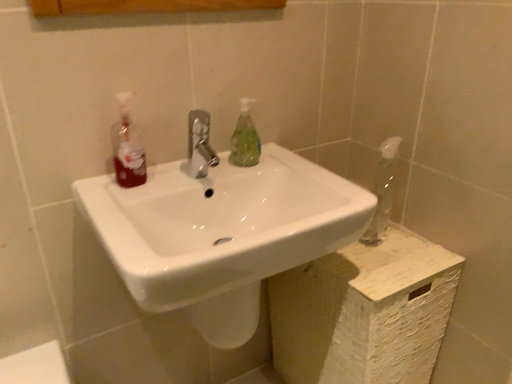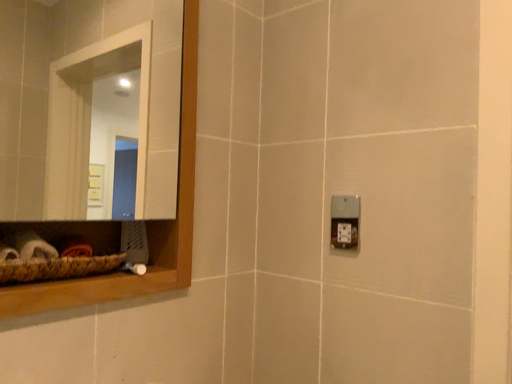
Question: Which way did the camera rotate in the video?

Choices:
 (A) rotated left
 (B) rotated right

Answer: (B)